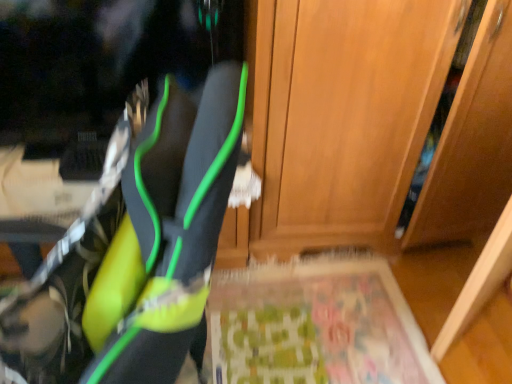
Question: Is green fabric yoga mat at lower center to the left or to the right of wooden door at center in the image?

Choices:
 (A) right
 (B) left

Answer: (B)

Question: From a real-world perspective, relative to wooden door at center, is green fabric yoga mat at lower center vertically above or below?

Choices:
 (A) above
 (B) below

Answer: (B)

Question: Which of these objects is positioned closest to the green fabric yoga mat at lower center?

Choices:
 (A) wooden door at center
 (B) neon yellow fabric shoe at left

Answer: (A)

Question: Estimate the real-world distances between objects in this image. Which object is closer to the green fabric yoga mat at lower center?

Choices:
 (A) wooden door at center
 (B) neon yellow fabric shoe at left

Answer: (A)